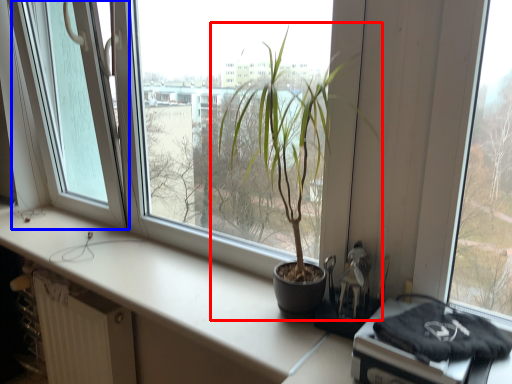
Question: Which object appears farthest to the camera in this image, houseplant (highlighted by a red box) or glass door (highlighted by a blue box)?

Choices:
 (A) houseplant
 (B) glass door

Answer: (B)